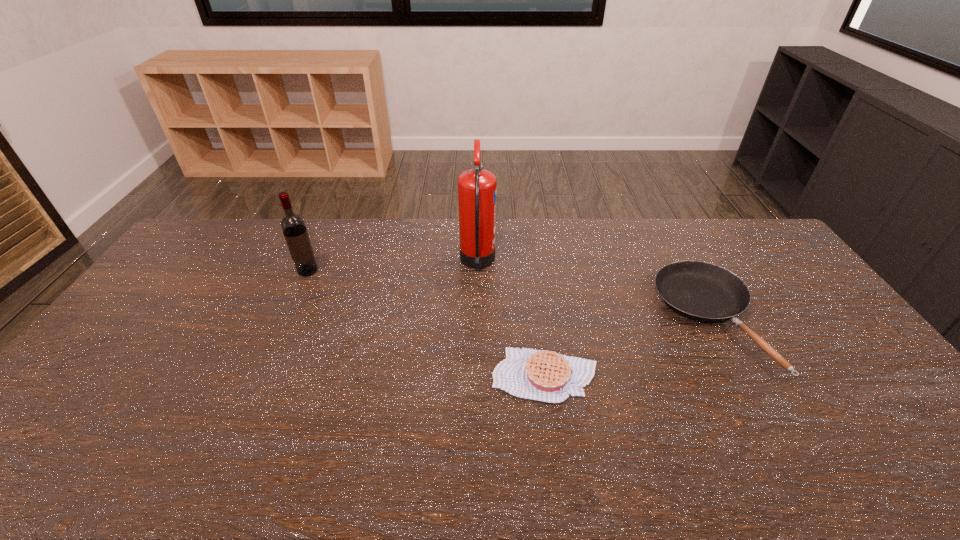
This screenshot has width=960, height=540. Find the location of `free spot between the pie and the wine bottle`. free spot between the pie and the wine bottle is located at coordinates (426, 323).

This screenshot has width=960, height=540. I want to click on free space between the tallest object and the rightmost object, so click(x=593, y=291).

In order to click on vacant area that lies between the fire extinguisher and the leftmost object in this screenshot , I will do tap(393, 267).

Image resolution: width=960 pixels, height=540 pixels. In order to click on free space between the pie and the tallest object in this screenshot , I will do (x=512, y=319).

What are the coordinates of `free spot between the frying pan and the pie` in the screenshot? It's located at (628, 348).

Locate which object is the closest to the rightmost object. Please provide its 2D coordinates. Your answer should be formatted as a tuple, i.e. [(x, y)], where the tuple contains the x and y coordinates of a point satisfying the conditions above.

[(542, 375)]

The image size is (960, 540). Find the location of `object that is the closest to the frying pan`. object that is the closest to the frying pan is located at coordinates (542, 375).

This screenshot has height=540, width=960. I want to click on free spot that satisfies the following two spatial constraints: 1. on the surface of the frying pan; 2. on the right side of the fire extinguisher, so click(477, 320).

Image resolution: width=960 pixels, height=540 pixels. Find the location of `vacant region that satisfies the following two spatial constraints: 1. on the surface of the pie; 2. on the left side of the tallest object`. vacant region that satisfies the following two spatial constraints: 1. on the surface of the pie; 2. on the left side of the tallest object is located at coordinates (477, 375).

I want to click on vacant space that satisfies the following two spatial constraints: 1. on the surface of the pie; 2. on the left side of the fire extinguisher, so click(477, 375).